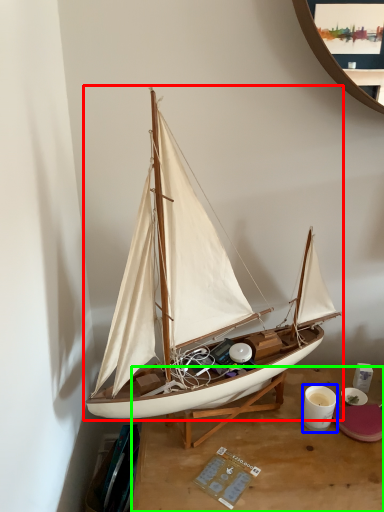
Question: Estimate the real-world distances between objects in this image. Which object is farther from boat (highlighted by a red box), coffee cup (highlighted by a blue box) or desk (highlighted by a green box)?

Choices:
 (A) coffee cup
 (B) desk

Answer: (A)